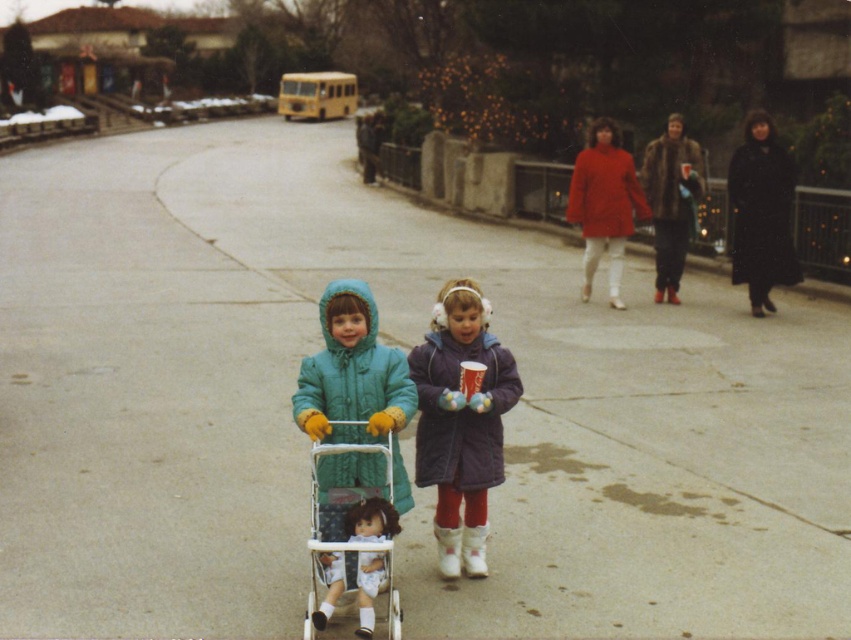
You are a parent trying to decide whether to carry both the purple matte coat at center and the white plastic baby carriage at center in one hand. Based on their sizes, do you think it is possible?

The purple matte coat at center is bigger than the white plastic baby carriage at center, so it might be difficult to carry both in one hand due to the coat taking up more space.

You are a parent trying to walk through a narrow hallway with your child. You see the purple matte coat at center and the white plastic baby carriage at center in the hallway. Which object should you move to ensure you can pass through?

You should move the purple matte coat at center because it might be wider than the white plastic baby carriage at center, making it the larger obstacle in the narrow space.

You are a parent trying to cross the street with your child. The child is wearing the purple matte coat at center and is holding the handle of the white plastic baby carriage at center. You notice a car approaching from behind. Which object should you grab to quickly stop the carriage?

You should grab the handle of the white plastic baby carriage at center because it is behind the purple matte coat at center, making it accessible to stop the carriage quickly.